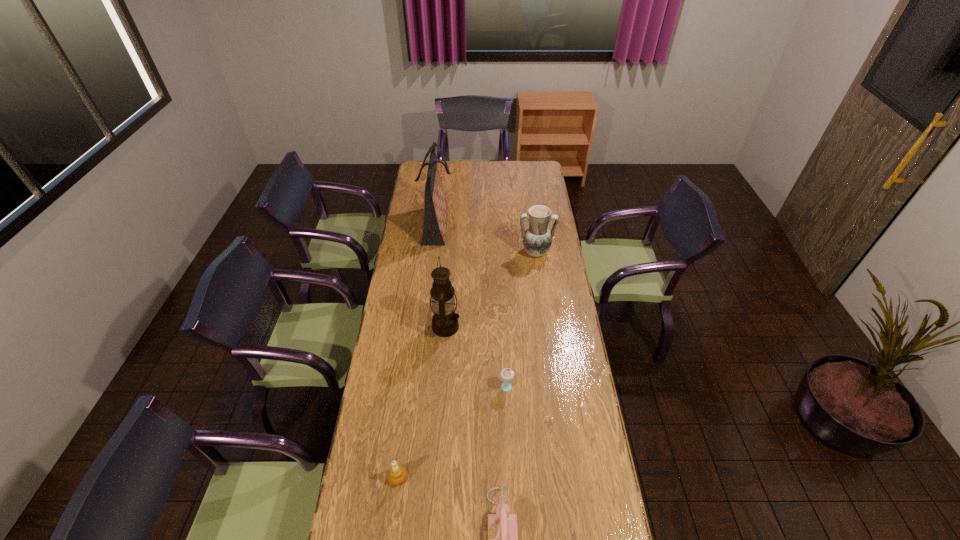
At what (x,y) coordinates should I click in order to perform the action: click on free space located on the straw side of the third nearest object. Please return your answer as a coordinate pair (x, y). This screenshot has width=960, height=540. Looking at the image, I should click on (467, 389).

This screenshot has width=960, height=540. Identify the location of vacant space located 0.150m on the straw side of the third nearest object. (462, 389).

Identify the location of free location located 0.260m on the straw side of the third nearest object. This screenshot has height=540, width=960. (433, 389).

This screenshot has width=960, height=540. Identify the location of blank area located on the back of the candle_holder. (411, 378).

What are the coordinates of `shopping bag located in the left edge section of the desktop` in the screenshot? It's located at (436, 208).

At what (x,y) coordinates should I click in order to perform the action: click on candle_holder located at the left edge. Please return your answer as a coordinate pair (x, y). Image resolution: width=960 pixels, height=540 pixels. Looking at the image, I should click on (397, 475).

The height and width of the screenshot is (540, 960). In order to click on object at the right edge in this screenshot , I will do `click(537, 239)`.

The width and height of the screenshot is (960, 540). In the image, there is a desktop. What are the coordinates of `free space at the far edge` in the screenshot? It's located at (457, 176).

The image size is (960, 540). I want to click on vacant space at the left edge, so click(x=403, y=272).

In the image, there is a desktop. Where is `vacant space at the right edge`? vacant space at the right edge is located at coordinates (540, 332).